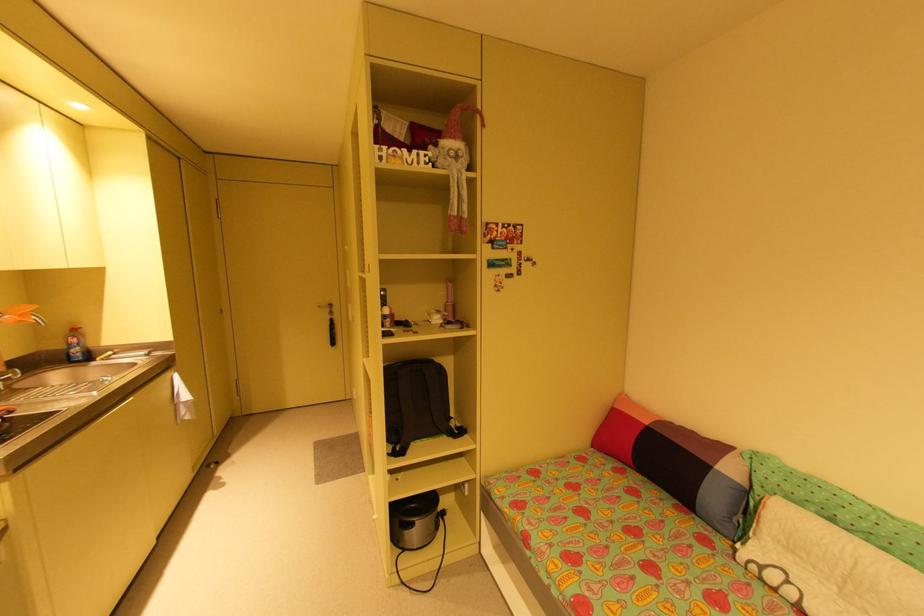
Locate an element on the screen. Image resolution: width=924 pixels, height=616 pixels. orange faucet handle is located at coordinates (20, 315).